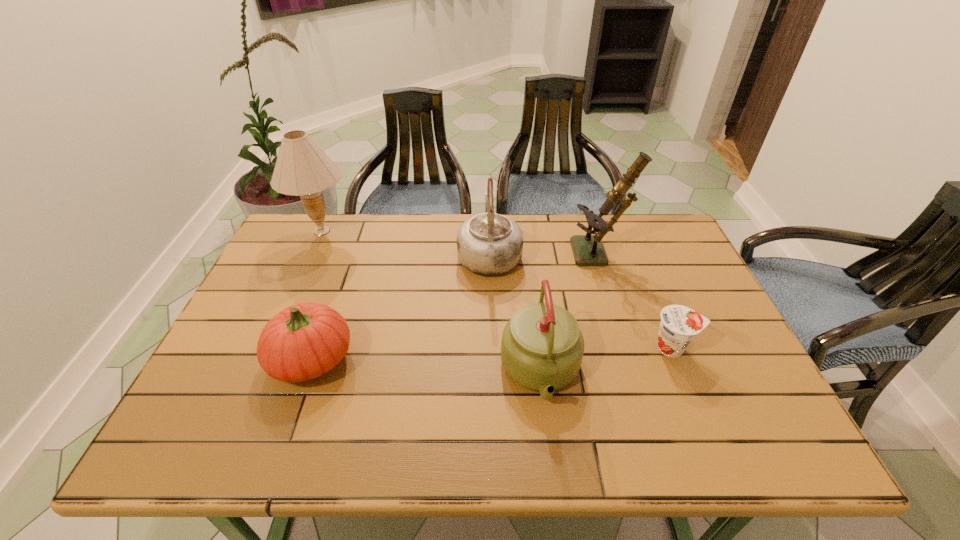
Image resolution: width=960 pixels, height=540 pixels. What are the coordinates of `vacant space that's between the shortest object and the farther kettle` in the screenshot? It's located at (581, 301).

This screenshot has height=540, width=960. Find the location of `free space between the farther kettle and the lampshade`. free space between the farther kettle and the lampshade is located at coordinates (406, 242).

At what (x,y) coordinates should I click in order to perform the action: click on vacant space that is in between the lampshade and the yogurt. Please return your answer as a coordinate pair (x, y). This screenshot has width=960, height=540. Looking at the image, I should click on (497, 289).

Find the location of `empty space that is in between the lampshade and the farther kettle`. empty space that is in between the lampshade and the farther kettle is located at coordinates (406, 242).

This screenshot has width=960, height=540. Identify the location of free spot between the nearer kettle and the lampshade. (431, 302).

This screenshot has width=960, height=540. I want to click on object that is the third nearest to the microscope, so click(542, 347).

Select which object appears as the third closest to the nearer kettle. Please provide its 2D coordinates. Your answer should be formatted as a tuple, i.e. [(x, y)], where the tuple contains the x and y coordinates of a point satisfying the conditions above.

[(588, 249)]

At what (x,y) coordinates should I click in order to perform the action: click on free spot that satisfies the following two spatial constraints: 1. at the eyepiece of the microscope; 2. at the spout of the nearer kettle. Please return your answer as a coordinate pair (x, y). The image size is (960, 540). Looking at the image, I should click on (637, 372).